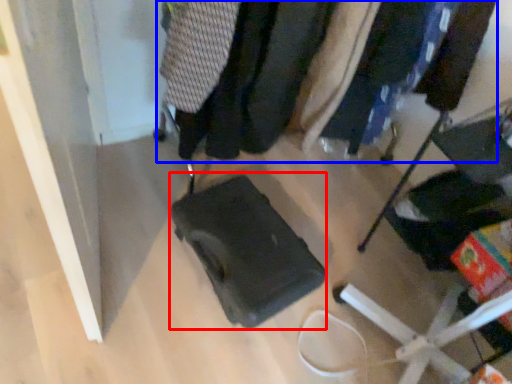
Question: Which object is further to the camera taking this photo, luggage (highlighted by a red box) or closet (highlighted by a blue box)?

Choices:
 (A) luggage
 (B) closet

Answer: (A)